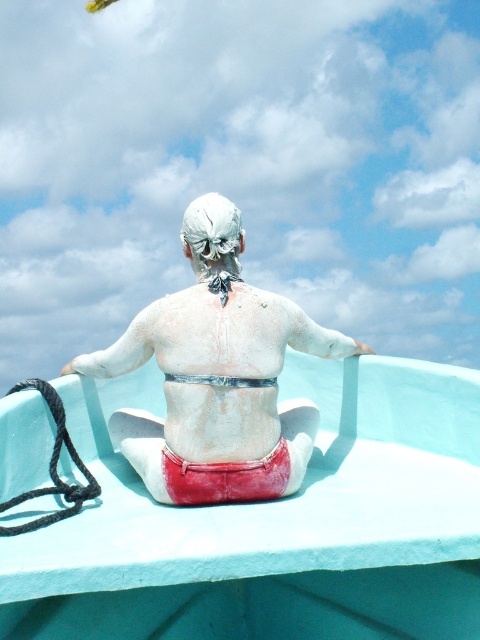
Does teal plastic boat at center have a smaller size compared to white matte man at center?

Actually, teal plastic boat at center might be larger than white matte man at center.

Between teal plastic boat at center and white matte man at center, which one appears on the left side from the viewer's perspective?

white matte man at center is more to the left.

Is point (13, 403) more distant than point (119, 346)?

No, it is not.

Locate an element on the screen. teal plastic boat at center is located at coordinates (273, 524).